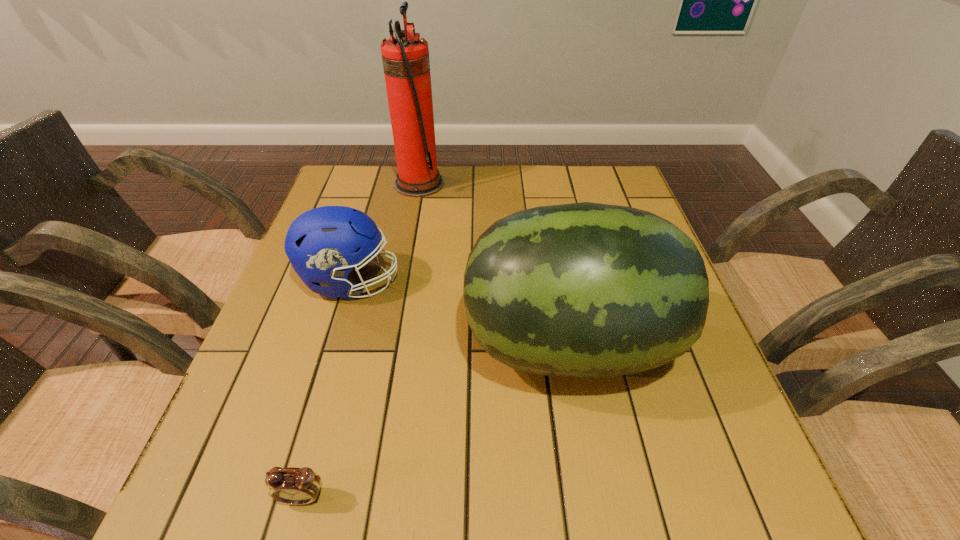
Locate an element on the screen. unoccupied area between the football helmet and the shortest object is located at coordinates (326, 389).

Locate an element on the screen. free space that is in between the second shortest object and the watermelon is located at coordinates (460, 313).

What are the coordinates of `vacant area between the fire extinguisher and the nearest object` in the screenshot? It's located at (361, 340).

Locate an element on the screen. unoccupied area between the nearest object and the watermelon is located at coordinates (436, 420).

Find the location of `empty space between the third tallest object and the fire extinguisher`. empty space between the third tallest object and the fire extinguisher is located at coordinates (385, 232).

At what (x,y) coordinates should I click in order to perform the action: click on free point between the tallest object and the alarm clock. Please return your answer as a coordinate pair (x, y). Looking at the image, I should click on (361, 340).

The image size is (960, 540). Find the location of `the closest object to the third tallest object`. the closest object to the third tallest object is located at coordinates (585, 290).

Select which object is the closest to the third shortest object. Please provide its 2D coordinates. Your answer should be formatted as a tuple, i.e. [(x, y)], where the tuple contains the x and y coordinates of a point satisfying the conditions above.

[(324, 244)]

Locate an element on the screen. The image size is (960, 540). vacant area in the image that satisfies the following two spatial constraints: 1. on the front-facing side of the second shortest object; 2. on the left side of the rightmost object is located at coordinates (332, 343).

Image resolution: width=960 pixels, height=540 pixels. What are the coordinates of `vacant region that satisfies the following two spatial constraints: 1. at the discharge end of the rightmost object; 2. on the left side of the fire extinguisher` in the screenshot? It's located at (390, 343).